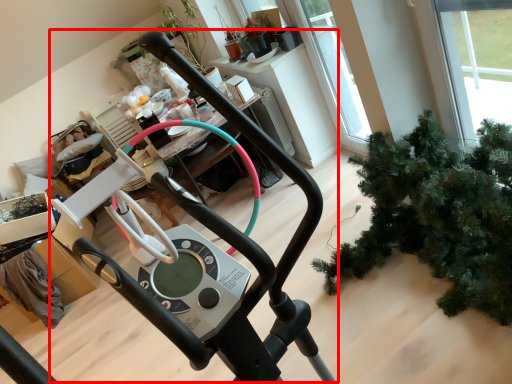
Question: From the image's perspective, what is the correct spatial relationship of sport equipment (annotated by the red box) in relation to houseplant?

Choices:
 (A) below
 (B) above

Answer: (A)